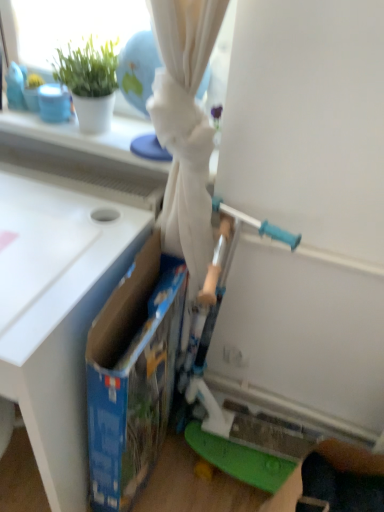
Question: Considering the relative sizes of blue cardboard box at center and white matte table at left in the image provided, is blue cardboard box at center wider than white matte table at left?

Choices:
 (A) no
 (B) yes

Answer: (A)

Question: Is white matte table at left completely or partially inside blue cardboard box at center?

Choices:
 (A) yes
 (B) no

Answer: (B)

Question: Does blue cardboard box at center have a lesser height compared to white matte table at left?

Choices:
 (A) yes
 (B) no

Answer: (A)

Question: From the image's perspective, is blue cardboard box at center beneath white matte table at left?

Choices:
 (A) yes
 (B) no

Answer: (A)

Question: Can you confirm if blue cardboard box at center is positioned to the left of white matte table at left?

Choices:
 (A) yes
 (B) no

Answer: (B)

Question: Is blue cardboard box at center turned away from white matte table at left?

Choices:
 (A) yes
 (B) no

Answer: (A)

Question: From a real-world perspective, is white matte table at left located higher than blue cardboard box at center?

Choices:
 (A) yes
 (B) no

Answer: (A)

Question: Does white matte table at left lie behind blue cardboard box at center?

Choices:
 (A) yes
 (B) no

Answer: (B)

Question: Would you say white matte table at left is a long distance from blue cardboard box at center?

Choices:
 (A) yes
 (B) no

Answer: (B)

Question: Can you confirm if white matte table at left is bigger than blue cardboard box at center?

Choices:
 (A) no
 (B) yes

Answer: (B)

Question: Could you tell me if white matte table at left is turned towards blue cardboard box at center?

Choices:
 (A) yes
 (B) no

Answer: (B)

Question: From the image's perspective, is white matte table at left located beneath blue cardboard box at center?

Choices:
 (A) no
 (B) yes

Answer: (A)

Question: From a real-world perspective, relative to blue cardboard box at center, is white matte table at left vertically above or below?

Choices:
 (A) above
 (B) below

Answer: (A)